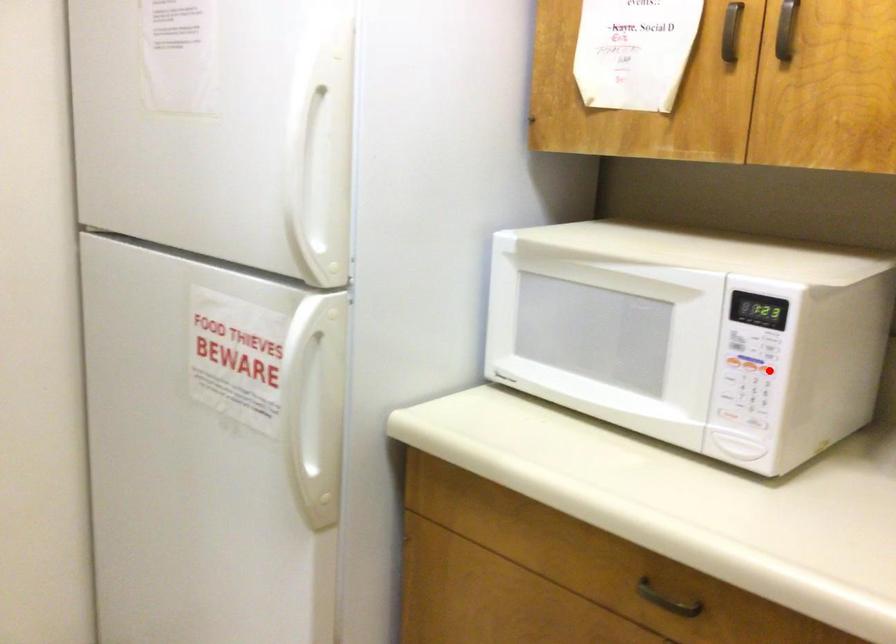
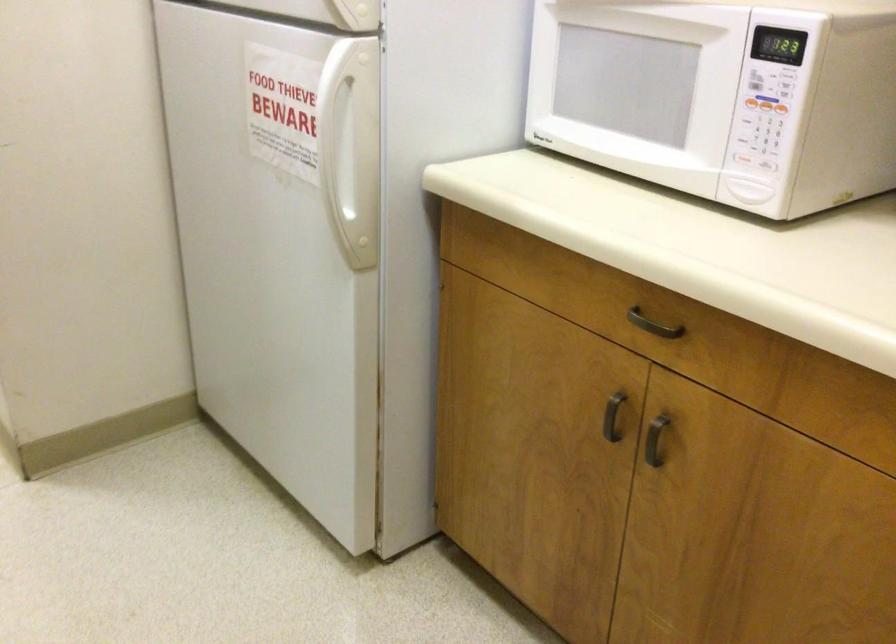
Where in the second image is the point corresponding to the highlighted location from the first image?

(780, 108)